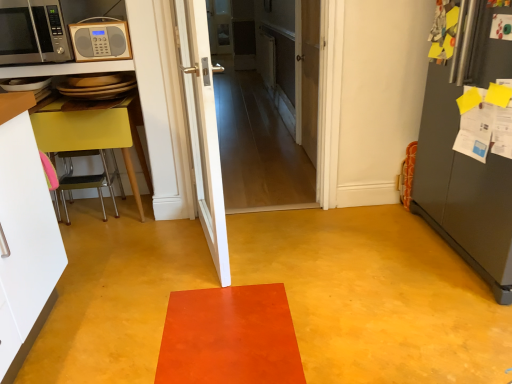
Question: Considering the relative sizes of silver metallic microwave at upper left, the first microwave oven from the left, and yellow matte table at left in the image provided, is silver metallic microwave at upper left, the first microwave oven from the left, taller than yellow matte table at left?

Choices:
 (A) yes
 (B) no

Answer: (B)

Question: From the image's perspective, is silver metallic microwave at upper left, marked as the 2th microwave oven in a right-to-left arrangement, located above yellow matte table at left?

Choices:
 (A) no
 (B) yes

Answer: (B)

Question: Is silver metallic microwave at upper left, the first microwave oven from the left, positioned far away from yellow matte table at left?

Choices:
 (A) yes
 (B) no

Answer: (B)

Question: Is yellow matte table at left located within silver metallic microwave at upper left, the first microwave oven from the left?

Choices:
 (A) yes
 (B) no

Answer: (B)

Question: From a real-world perspective, is silver metallic microwave at upper left, the first microwave oven from the left, beneath yellow matte table at left?

Choices:
 (A) no
 (B) yes

Answer: (A)

Question: Is silver metallic microwave at upper left, the first microwave oven from the left, wider than yellow matte table at left?

Choices:
 (A) no
 (B) yes

Answer: (A)

Question: Is silver metallic microwave at upper left, marked as the 2th microwave oven in a right-to-left arrangement, shorter than wooden door at center, marked as the third door in a front-to-back arrangement?

Choices:
 (A) yes
 (B) no

Answer: (A)

Question: Could wooden door at center, which is the first door in back-to-front order, be considered to be inside silver metallic microwave at upper left, marked as the 2th microwave oven in a right-to-left arrangement?

Choices:
 (A) no
 (B) yes

Answer: (A)

Question: Is silver metallic microwave at upper left, marked as the 2th microwave oven in a right-to-left arrangement, positioned with its back to wooden door at center, which is the first door in back-to-front order?

Choices:
 (A) yes
 (B) no

Answer: (B)

Question: Is silver metallic microwave at upper left, marked as the 2th microwave oven in a right-to-left arrangement, positioned beyond the bounds of wooden door at center, marked as the third door in a front-to-back arrangement?

Choices:
 (A) no
 (B) yes

Answer: (B)

Question: From the image's perspective, is silver metallic microwave at upper left, marked as the 2th microwave oven in a right-to-left arrangement, above wooden door at center, marked as the third door in a front-to-back arrangement?

Choices:
 (A) yes
 (B) no

Answer: (A)

Question: Does silver metallic microwave at upper left, marked as the 2th microwave oven in a right-to-left arrangement, lie behind wooden door at center, marked as the third door in a front-to-back arrangement?

Choices:
 (A) yes
 (B) no

Answer: (B)

Question: Is white glossy door at center, which appears as the first door when viewed from the front, outside of wooden door at center, which is the first door in back-to-front order?

Choices:
 (A) yes
 (B) no

Answer: (A)